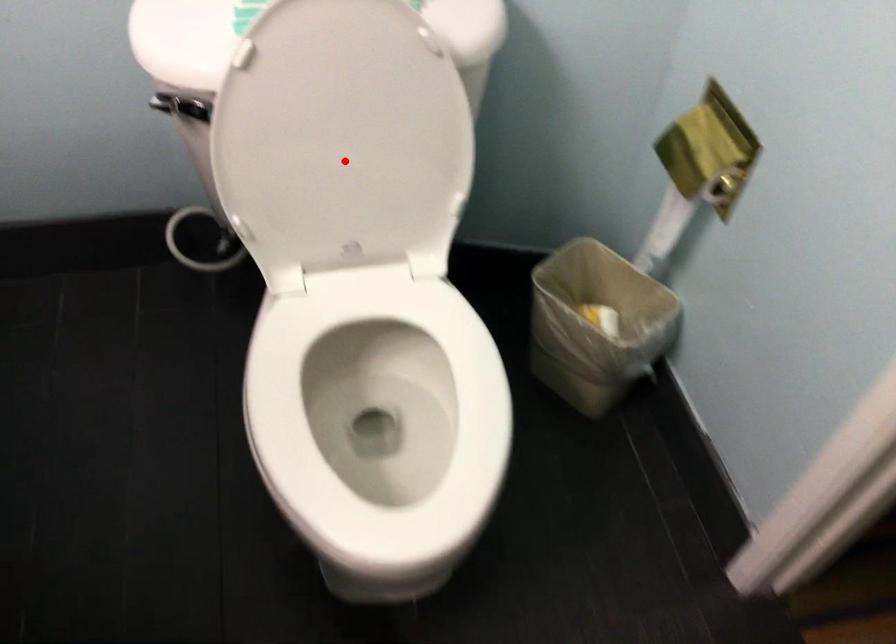
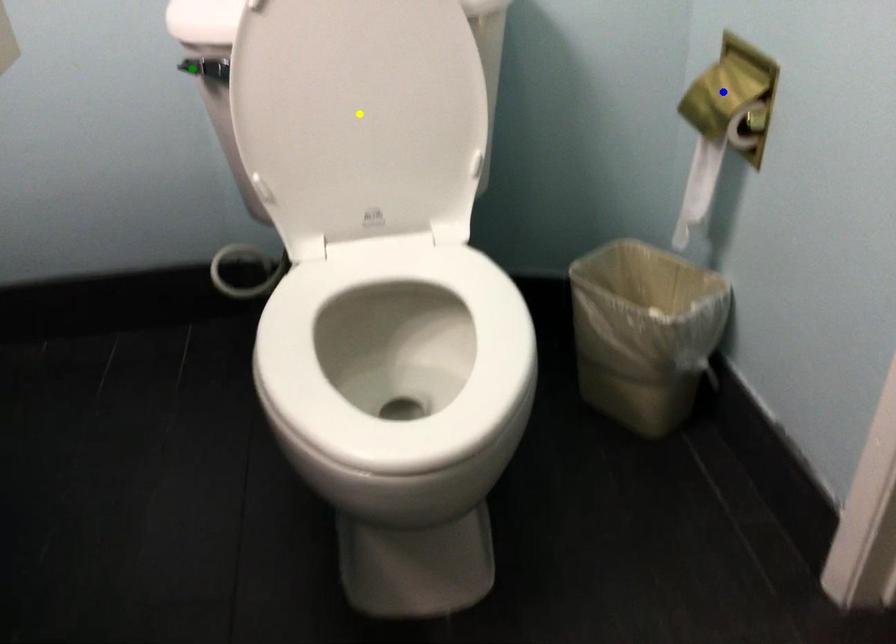
Question: I am providing you with two images of the same scene from different viewpoints. A red point is marked on the first image. You are given multiple points on the second image. Which point in image 2 represents the same 3d spot as the red point in image 1?

Choices:
 (A) green point
 (B) yellow point
 (C) blue point

Answer: (B)